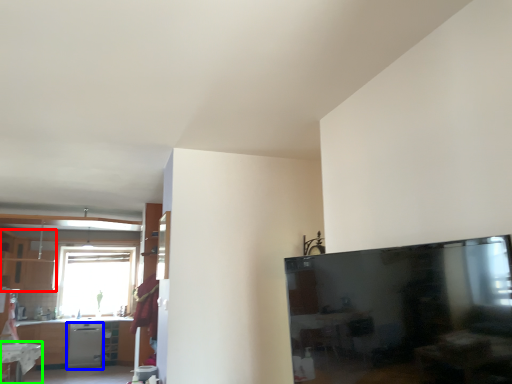
Question: Which object is the farthest from cabinetry (highlighted by a red box)? Choose among these: dish washer (highlighted by a blue box) or table (highlighted by a green box).

Choices:
 (A) dish washer
 (B) table

Answer: (B)